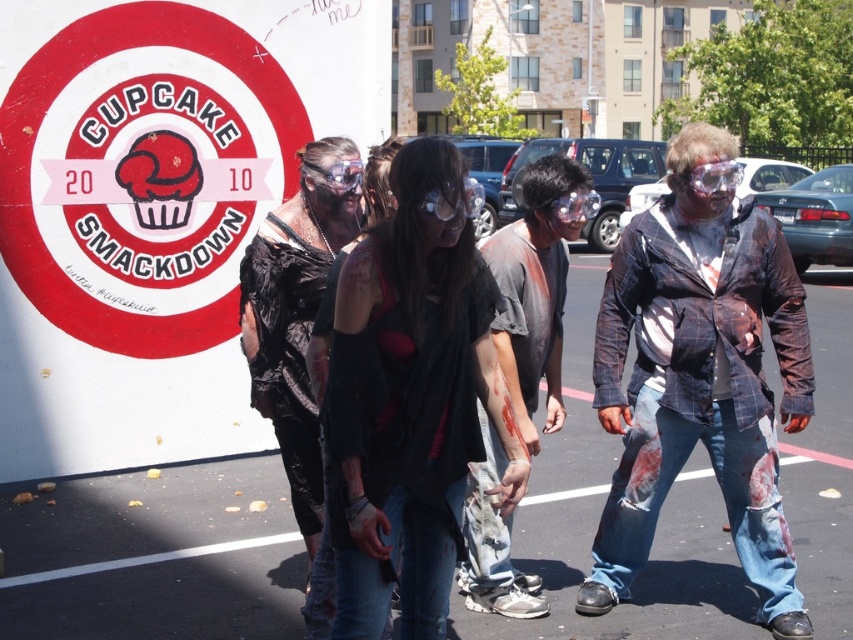
Question: Is distressed denim jacket at center smaller than distressed denim jeans at center?

Choices:
 (A) yes
 (B) no

Answer: (B)

Question: Among these points, which one is farthest from the camera?

Choices:
 (A) (543, 333)
 (B) (619, 300)
 (C) (245, 320)

Answer: (A)

Question: Considering the real-world distances, which object is farthest from the distressed denim jeans at center?

Choices:
 (A) black mesh vest at center
 (B) black plastic bag at center
 (C) distressed denim jacket at center

Answer: (B)

Question: Is distressed denim jacket at center bigger than black mesh vest at center?

Choices:
 (A) yes
 (B) no

Answer: (A)

Question: Does distressed denim jacket at center appear over distressed denim jeans at center?

Choices:
 (A) yes
 (B) no

Answer: (A)

Question: Which of the following is the closest to the observer?

Choices:
 (A) black plastic bag at center
 (B) distressed denim jacket at center

Answer: (B)